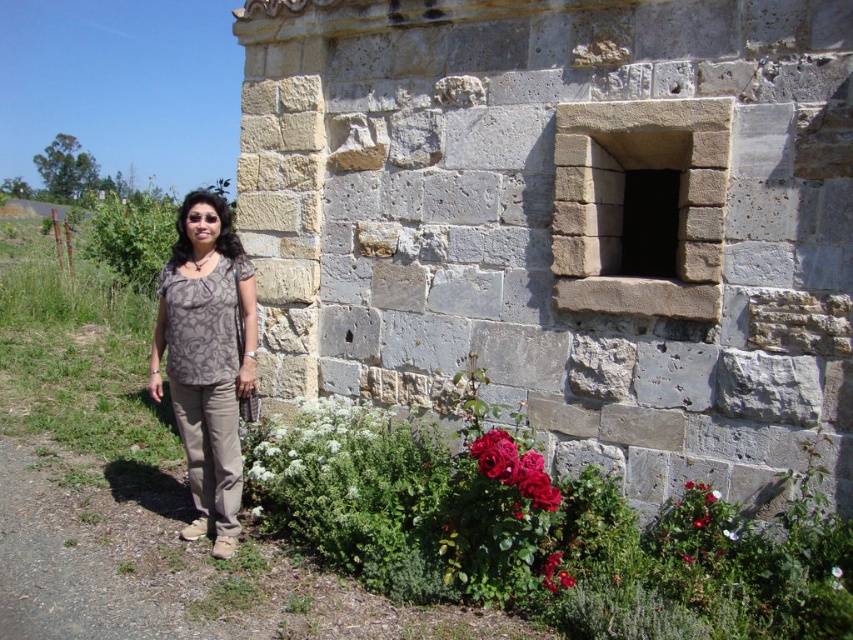
You are a photographer adjusting your camera to focus on two points in the image. The first point is at coordinate point [595,403] and the second is at point [495,474]. Which point is closer to your camera lens?

Point [595,403] is further to the viewer than point [495,474], so the second point is closer to the camera lens.

You are a photographer standing 2 meters away from the matte brown blouse at center. You want to take a photo of the vivid red petals at lower center without moving the camera. Can you focus on the petals while keeping the blouse in the frame?

The matte brown blouse at center and vivid red petals at lower center are 1.66 meters apart from each other. Since you are 2 meters away from the blouse, the petals are within the camera frame distance. Therefore, you can focus on the petals while keeping the blouse in the frame.